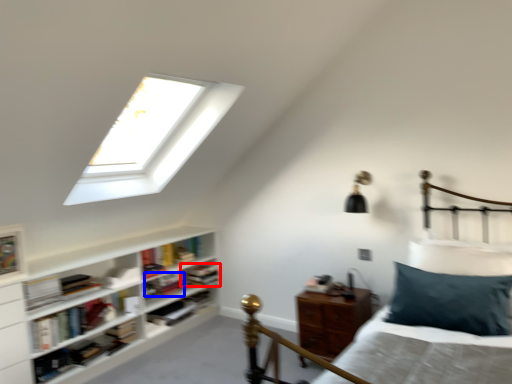
Question: Which of the following is the closest to the observer, book (highlighted by a red box) or book (highlighted by a blue box)?

Choices:
 (A) book
 (B) book

Answer: (B)